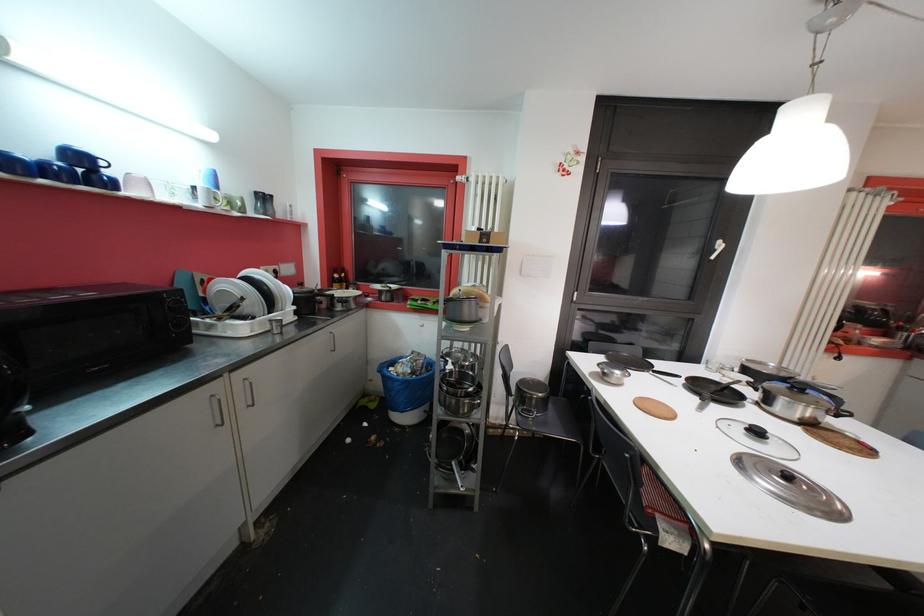
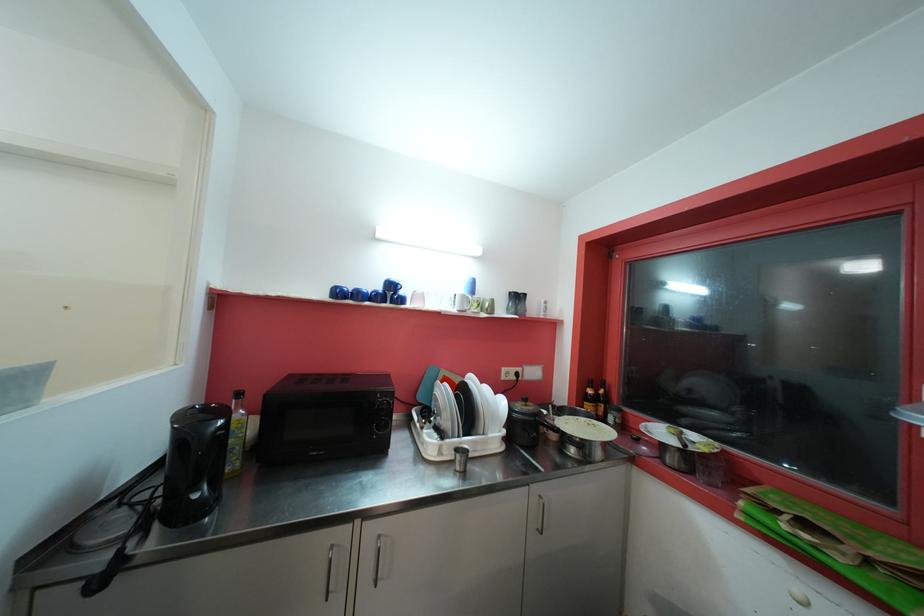
Locate, in the second image, the point that corresponds to [275,323] in the first image.

(462, 452)